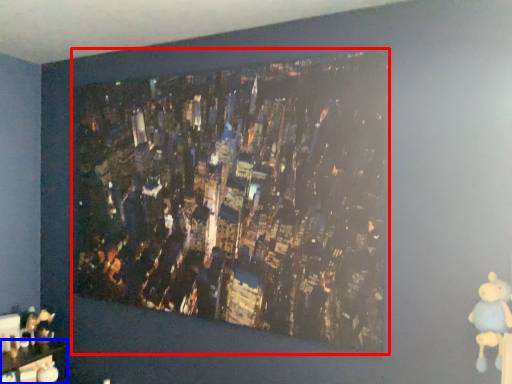
Question: Which object is closer to the camera taking this photo, picture frame (highlighted by a red box) or furniture (highlighted by a blue box)?

Choices:
 (A) picture frame
 (B) furniture

Answer: (A)